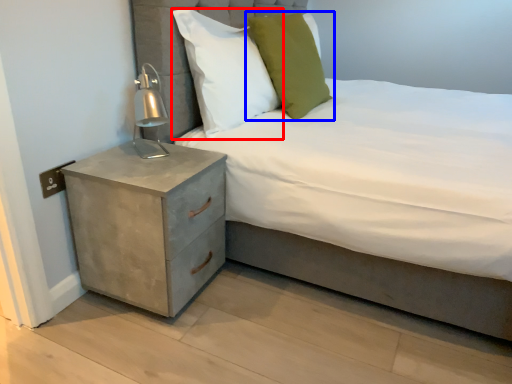
Question: Which object is further to the camera taking this photo, pillow (highlighted by a red box) or pillow (highlighted by a blue box)?

Choices:
 (A) pillow
 (B) pillow

Answer: (B)